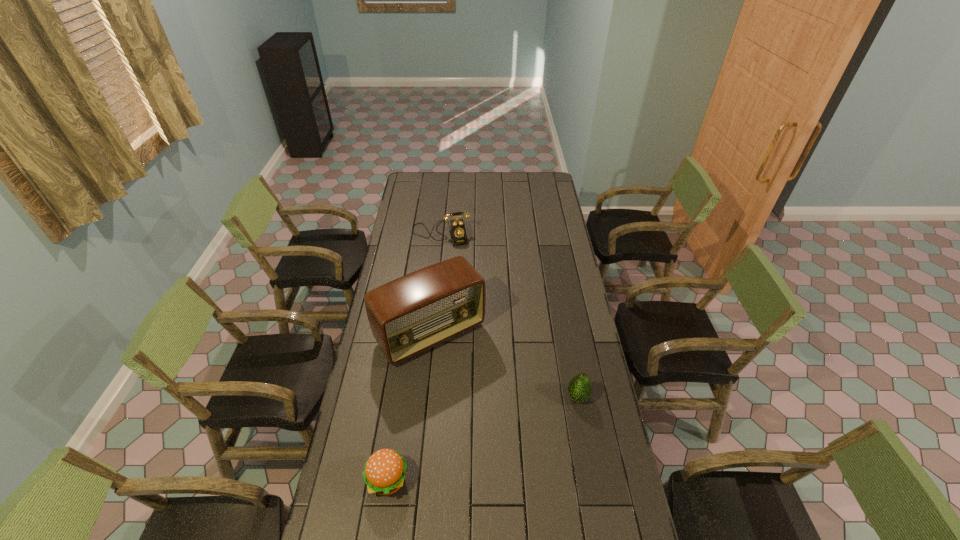
Locate an element on the screen. The width and height of the screenshot is (960, 540). the closest object relative to the avocado is located at coordinates tap(409, 315).

Locate an element on the screen. vacant space that satisfies the following two spatial constraints: 1. on the front side of the rightmost object; 2. on the left side of the tallest object is located at coordinates (424, 397).

In order to click on vacant space that satisfies the following two spatial constraints: 1. on the front side of the radio receiver; 2. on the left side of the rightmost object in this screenshot , I will do `click(424, 397)`.

I want to click on free location that satisfies the following two spatial constraints: 1. on the front side of the telephone; 2. on the right side of the tallest object, so click(x=430, y=334).